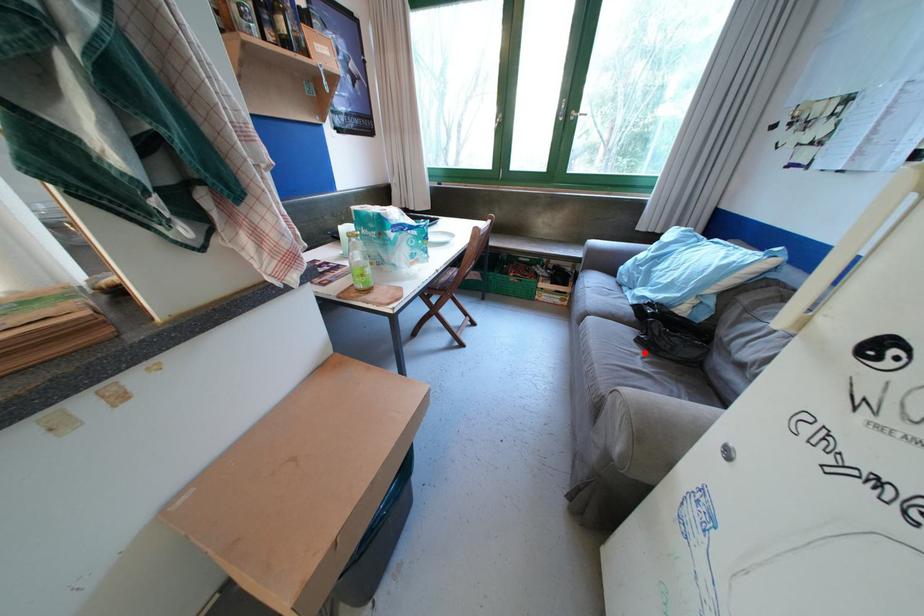
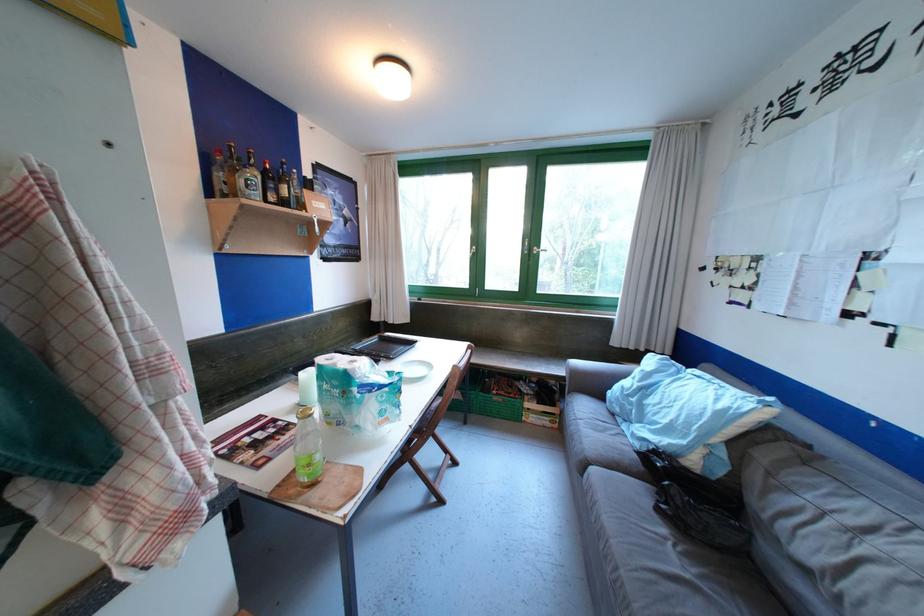
Where in the second image is the point corresponding to the highlighted location from the first image?

(671, 532)